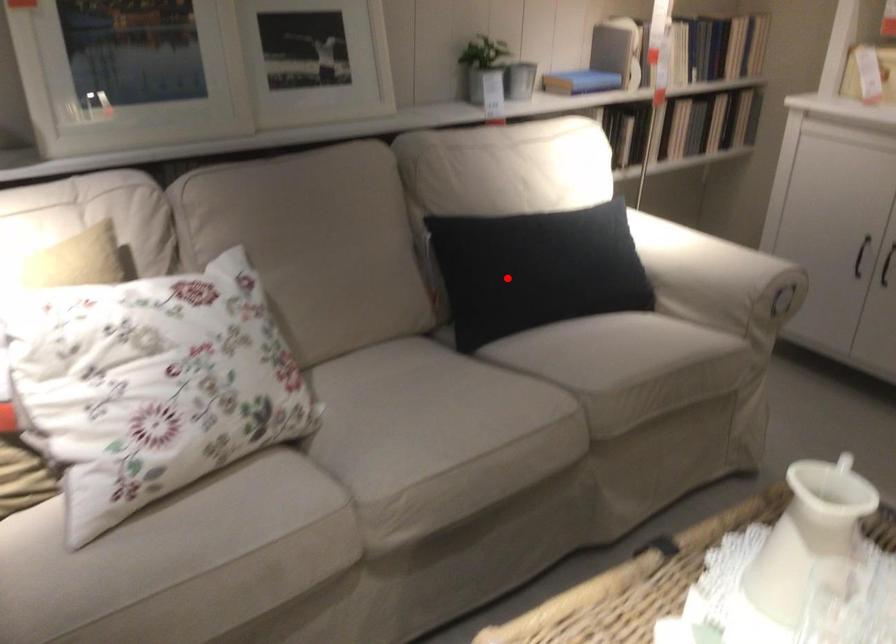
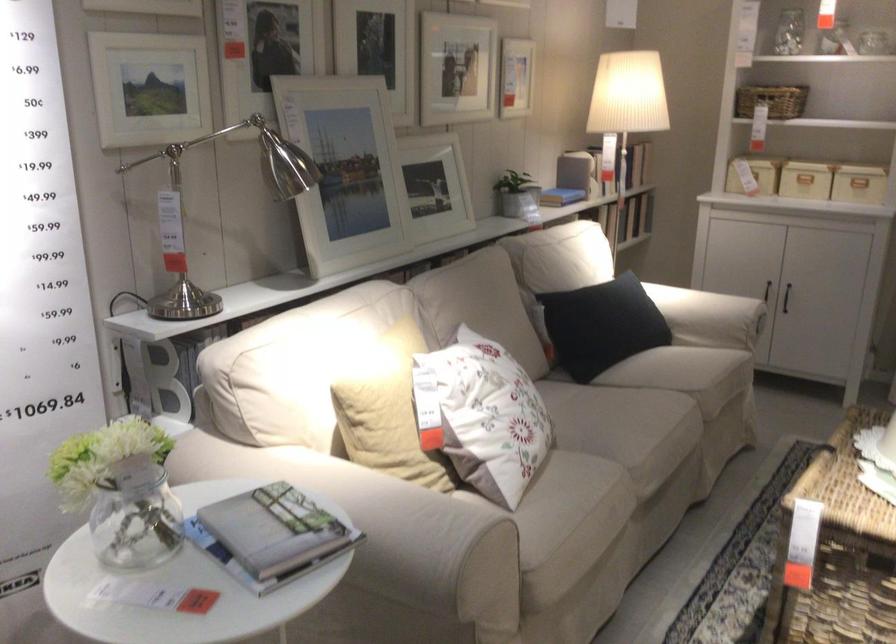
The point at the highlighted location is marked in the first image. Where is the corresponding point in the second image?

(600, 325)